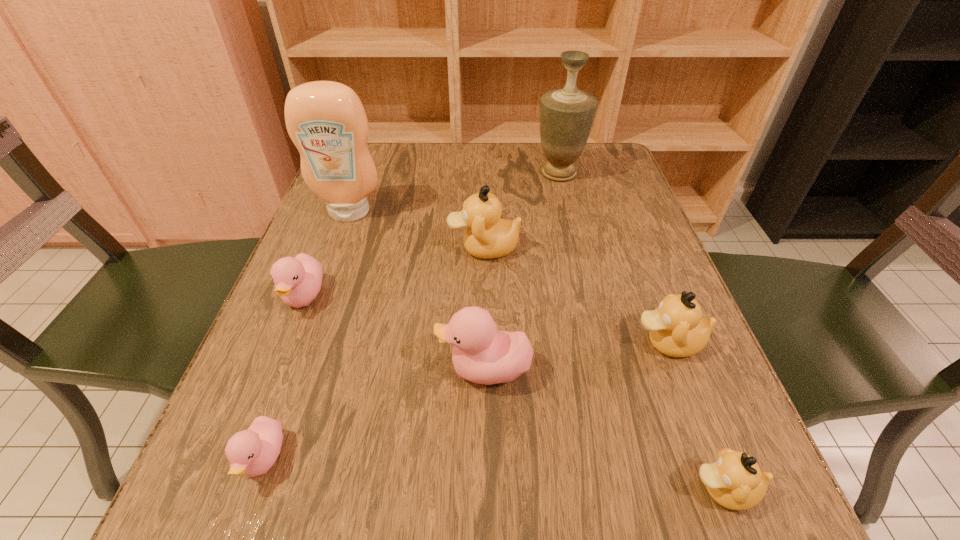
I want to click on duckling that is the third nearest to the second nearest tan duckling, so click(x=487, y=236).

Where is `the fourth closest duckling relative to the second smallest tan duckling`? This screenshot has height=540, width=960. the fourth closest duckling relative to the second smallest tan duckling is located at coordinates (252, 452).

The image size is (960, 540). Find the location of `tan duckling that stands as the second closest to the second biggest tan duckling`. tan duckling that stands as the second closest to the second biggest tan duckling is located at coordinates (487, 236).

I want to click on tan duckling that stands as the closest to the nearest tan duckling, so click(x=676, y=329).

Identify which pink duckling is the nearest to the smallest tan duckling. Please provide its 2D coordinates. Your answer should be formatted as a tuple, i.e. [(x, y)], where the tuple contains the x and y coordinates of a point satisfying the conditions above.

[(482, 354)]

The width and height of the screenshot is (960, 540). Identify the location of pink duckling that is the closest to the second smallest tan duckling. (482, 354).

Image resolution: width=960 pixels, height=540 pixels. I want to click on free space that satisfies the following two spatial constraints: 1. on the face of the second nearest tan duckling; 2. on the front-facing side of the shortest object, so click(x=712, y=459).